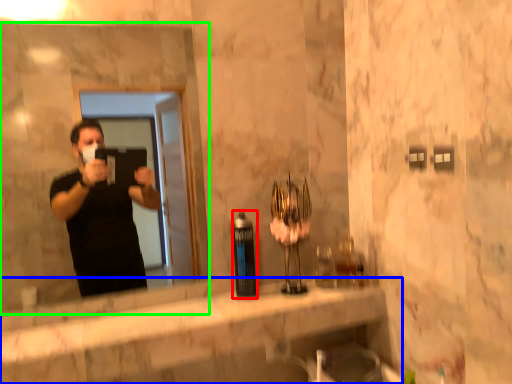
Question: Considering the real-world distances, which object is farthest from bottle (highlighted by a red box)? counter top (highlighted by a blue box) or mirror (highlighted by a green box)?

Choices:
 (A) counter top
 (B) mirror

Answer: (B)